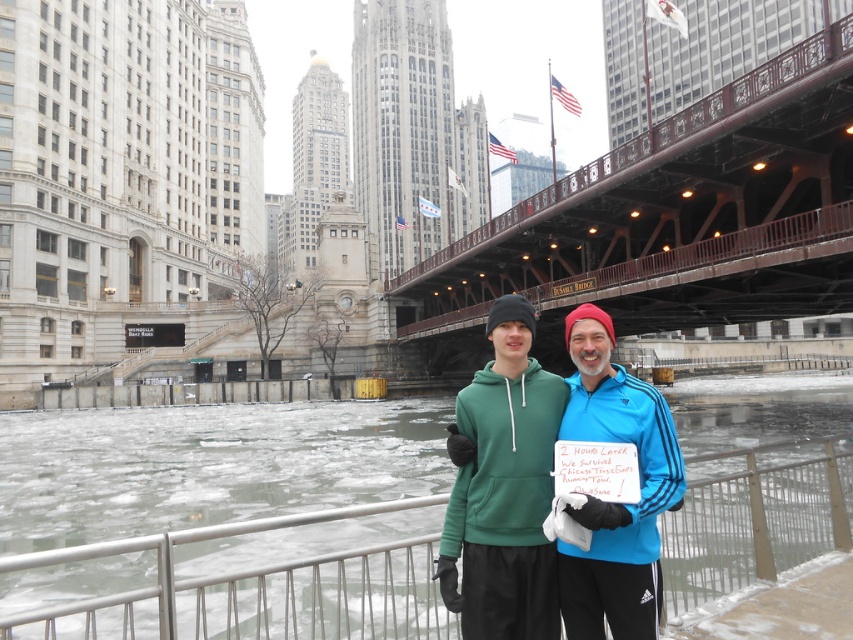
You are a photographer standing at the riverbank and want to take a photo of the brown wooden bridge at center. The camera you are using has a maximum focus range of 30 meters. Can you capture the bridge clearly?

The brown wooden bridge at center is 31.86 meters from viewer, which exceeds the camera maximum focus range of 30 meters. Therefore, you cannot capture the bridge clearly.

You are a delivery robot with a 20 meter range. You are at the frozen ice at center and need to deliver a package to the brown wooden bridge at center. Can you reach it within your range?

The distance between the frozen ice at center and the brown wooden bridge at center is 18.20 meters, so yes, the delivery robot can reach it within its 20 meter range.